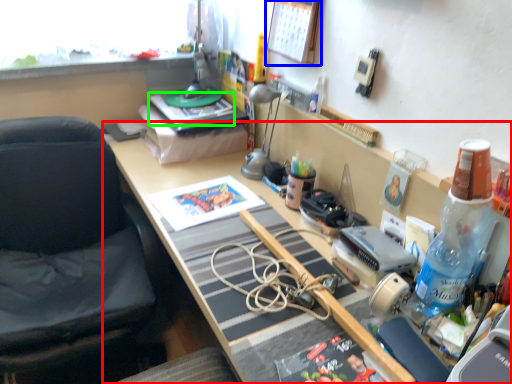
Question: Which object is the closest to the desk (highlighted by a red box)? Choose among these: picture frame (highlighted by a blue box) or book (highlighted by a green box).

Choices:
 (A) picture frame
 (B) book

Answer: (B)